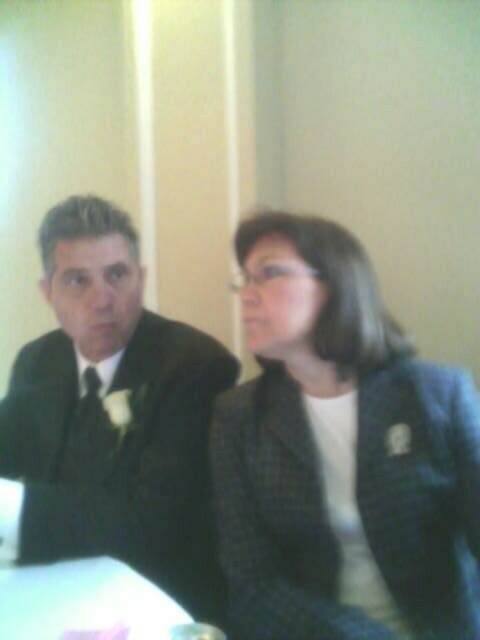
You are a tailor measuring clothes for two clients. The first client is wearing a matte black suit at left, and the second is wearing a dark gray textured blazer at center. Which client requires a longer coat length?

The matte black suit at left requires a longer coat length because the dark gray textured blazer at center is not as tall as it.

You are organizing a formal event and need to arrange two outfits on a display table. The display table has a left side and a right side. You have the dark gray textured blazer at center and the matte black suit at left. According to the image, which outfit should be placed on the left side of the display table?

The matte black suit at left should be placed on the left side of the display table because in the image, the dark gray textured blazer at center is to the right of the matte black suit at left, indicating its original position on the left.